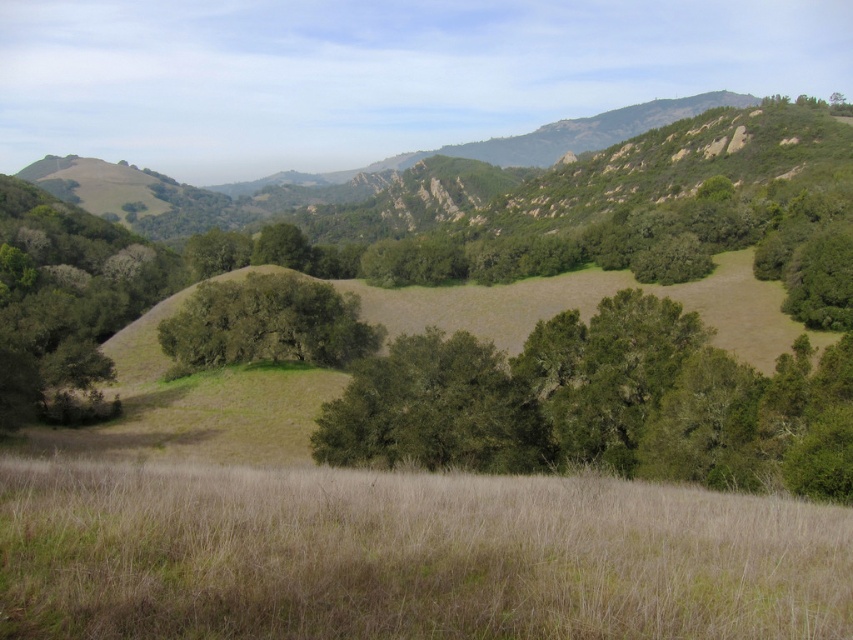
Question: Can you confirm if dry grass at lower center is positioned to the right of green leafy tree at center?

Choices:
 (A) yes
 (B) no

Answer: (A)

Question: Can you confirm if dry grass at lower center is positioned to the right of green leafy tree at center?

Choices:
 (A) yes
 (B) no

Answer: (A)

Question: Is dry grass at lower center to the left of green leafy tree at center from the viewer's perspective?

Choices:
 (A) yes
 (B) no

Answer: (B)

Question: Which point appears farthest from the camera in this image?

Choices:
 (A) (556, 573)
 (B) (184, 344)

Answer: (B)